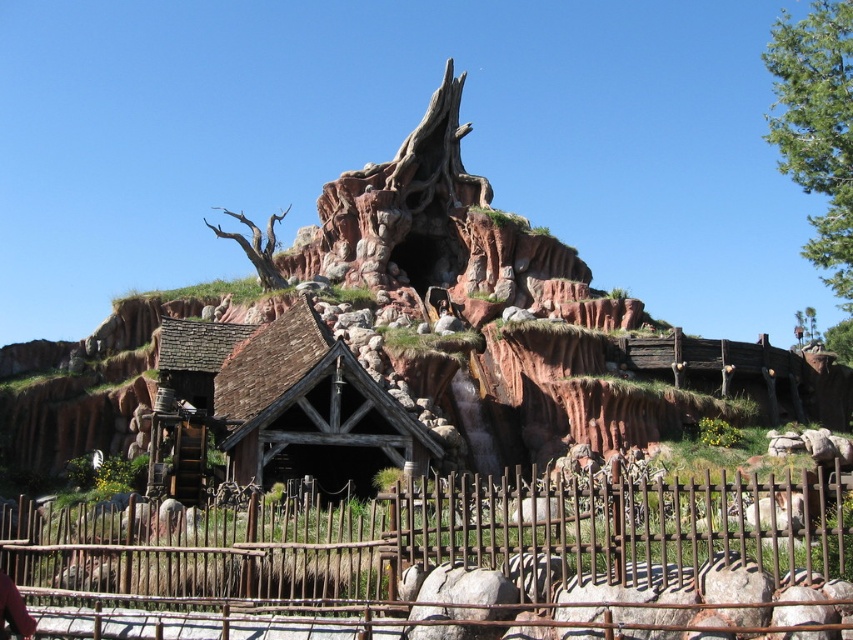
Who is more distant from viewer, (596, 516) or (814, 250)?

The point (814, 250) is behind.

Locate an element on the screen. The width and height of the screenshot is (853, 640). rustic wood fence at lower center is located at coordinates (453, 561).

Does green leafy tree at upper right have a smaller size compared to brown textured bark tree at upper center?

No.

Does green leafy tree at upper right have a greater height compared to brown textured bark tree at upper center?

Indeed, green leafy tree at upper right has a greater height compared to brown textured bark tree at upper center.

Does point (819, 244) come closer to viewer compared to point (247, 220)?

Yes, it is.

Identify the location of green leafy tree at upper right. (817, 128).

Can you confirm if rustic wood fence at lower center is positioned to the right of brown wooden hut at center?

Indeed, rustic wood fence at lower center is positioned on the right side of brown wooden hut at center.

You are a GUI agent. You are given a task and a screenshot of the screen. Output one action in this format:
    pyautogui.click(x=<x>, y=<y>)
    Task: Click on the rustic wood fence at lower center
    
    Given the screenshot: What is the action you would take?
    pyautogui.click(x=453, y=561)